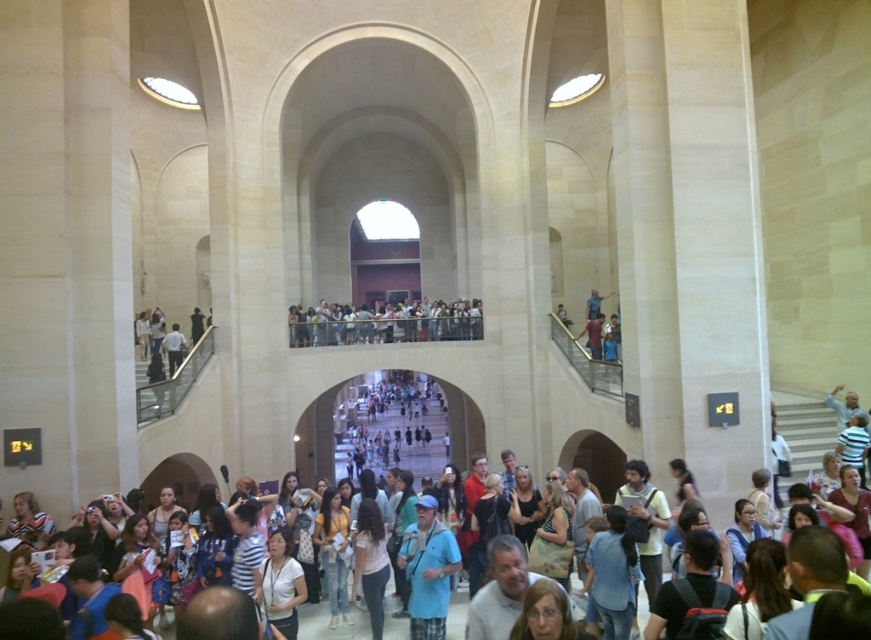
Does point (413, 579) lie behind point (269, 550)?

No, (413, 579) is in front of (269, 550).

Where is `blue plaid shirt at center`? blue plaid shirt at center is located at coordinates (429, 570).

Does light pink fabric at center have a smaller size compared to matte blue shirt at center?

Incorrect, light pink fabric at center is not smaller in size than matte blue shirt at center.

Describe the element at coordinates (370, 563) in the screenshot. The height and width of the screenshot is (640, 871). I see `light pink fabric at center` at that location.

Where is `light pink fabric at center`? This screenshot has height=640, width=871. light pink fabric at center is located at coordinates (370, 563).

Which is behind, point (262, 573) or point (734, 516)?

The point (734, 516) is more distant.

Does light blue shirt at center come behind matte blue shirt at center?

No, light blue shirt at center is in front of matte blue shirt at center.

Does point (282, 536) come behind point (755, 525)?

Yes.

This screenshot has width=871, height=640. I want to click on light blue shirt at center, so click(x=281, y=584).